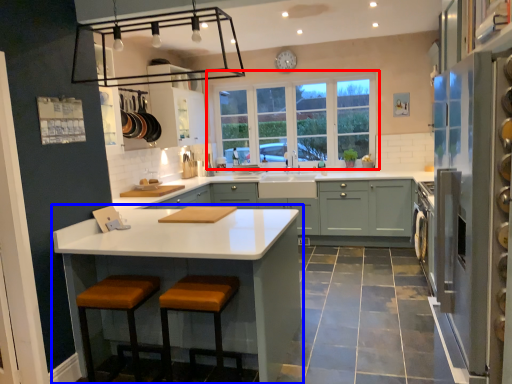
Question: Which point is further to the camera, window (highlighted by a red box) or countertop (highlighted by a blue box)?

Choices:
 (A) window
 (B) countertop

Answer: (A)